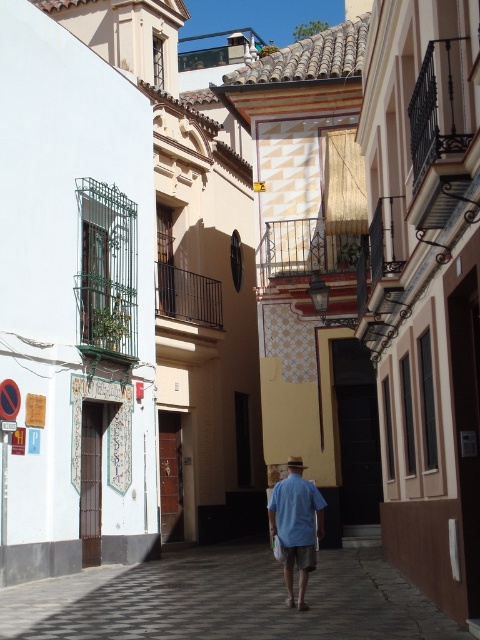
You are standing at the point marked as point (x=226, y=600) in the image. Which object is directly under your feet?

The checkerboard tile pavement at center is located at point (x=226, y=600), so the object directly under your feet is the checkerboard tile pavement at center.

In the scene shown: You are standing on the checkerboard tile pavement at center and want to walk towards the blue cotton shirt at center. Which direction should you move?

You should move to the right because the checkerboard tile pavement at center is to the left of the blue cotton shirt at center, so moving right will bring you closer to it.